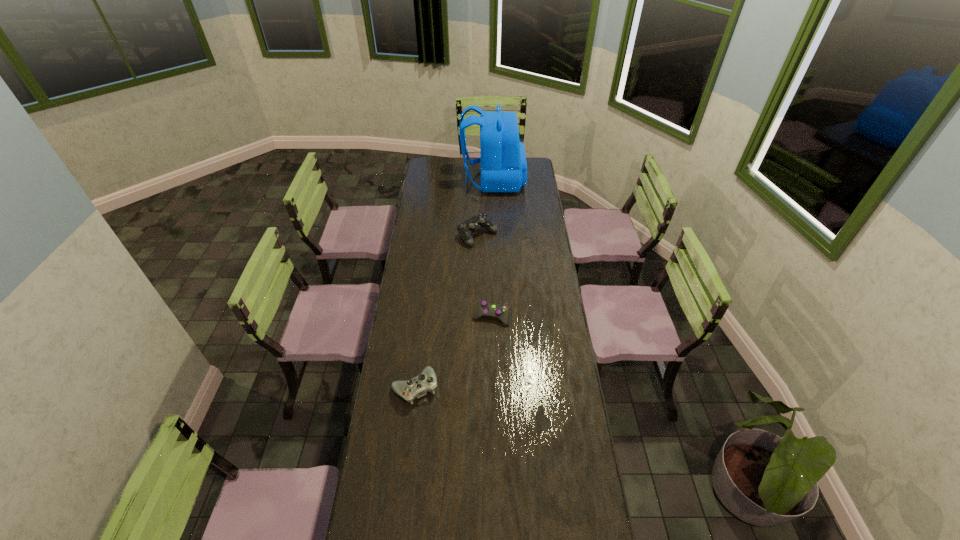
Locate an element on the screen. The image size is (960, 540). vacant space located on the right of the tallest control is located at coordinates (515, 235).

The width and height of the screenshot is (960, 540). I want to click on vacant space located 0.320m on the right of the second tallest control, so click(522, 388).

Find the location of `free spot located 0.160m on the back of the shortest control`. free spot located 0.160m on the back of the shortest control is located at coordinates (491, 281).

Image resolution: width=960 pixels, height=540 pixels. What are the coordinates of `object positioned at the far edge` in the screenshot? It's located at point(503,161).

Find the location of `object that is at the left edge`. object that is at the left edge is located at coordinates (418, 386).

At what (x,y) coordinates should I click in order to perform the action: click on object that is at the right edge. Please return your answer as a coordinate pair (x, y). Looking at the image, I should click on (503, 161).

Find the location of a particular element. object that is at the far right corner is located at coordinates point(503,161).

The width and height of the screenshot is (960, 540). Identify the location of free region at the far edge of the desktop. (458, 167).

I want to click on vacant space at the left edge of the desktop, so click(425, 301).

Locate an element on the screen. The height and width of the screenshot is (540, 960). free space at the right edge of the desktop is located at coordinates (544, 332).